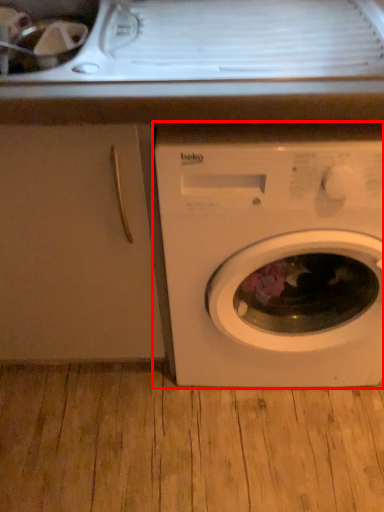
Question: From the image, what is the correct spatial relationship of washing machine (annotated by the red box) in relation to screen door?

Choices:
 (A) right
 (B) left

Answer: (A)